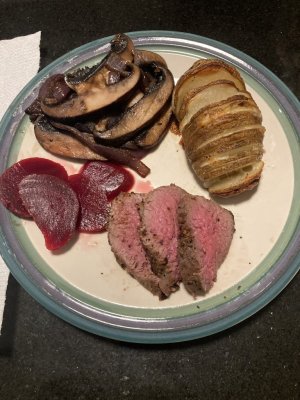
The image size is (300, 400). What are the coordinates of `paper napkin` in the screenshot? It's located at (26, 64).